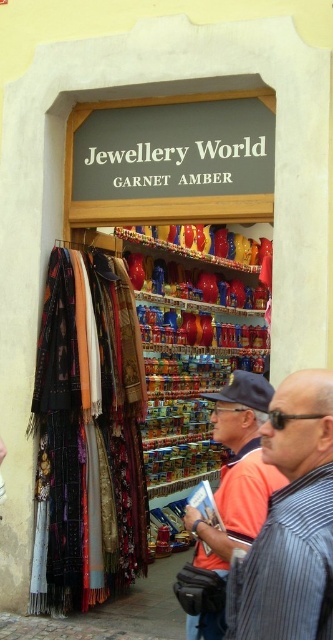
Question: Does striped fabric shirt at center have a lesser width compared to orange shirt at center?

Choices:
 (A) no
 (B) yes

Answer: (B)

Question: Which point is farther from the camera taking this photo?

Choices:
 (A) (203, 621)
 (B) (330, 637)

Answer: (A)

Question: Can you confirm if striped fabric shirt at center is positioned above orange shirt at center?

Choices:
 (A) no
 (B) yes

Answer: (B)

Question: Is striped fabric shirt at center smaller than orange shirt at center?

Choices:
 (A) yes
 (B) no

Answer: (A)